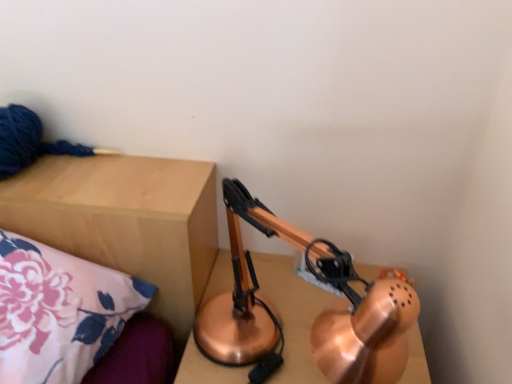
The width and height of the screenshot is (512, 384). I want to click on copper metallic lamp at center, so click(294, 314).

This screenshot has width=512, height=384. Describe the element at coordinates (294, 314) in the screenshot. I see `copper metallic lamp at center` at that location.

Locate an element on the screen. The height and width of the screenshot is (384, 512). copper metallic lamp at center is located at coordinates (294, 314).